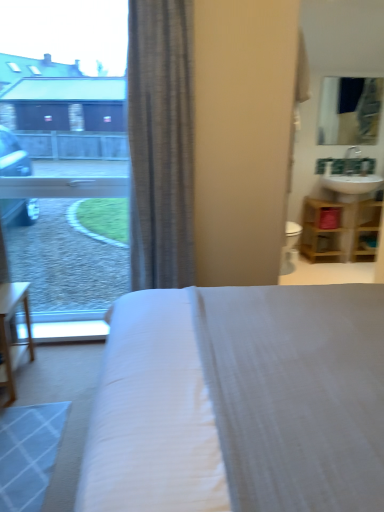
Question: Considering the relative positions of white fabric bed at center and gray textured curtain at center in the image provided, is white fabric bed at center behind gray textured curtain at center?

Choices:
 (A) no
 (B) yes

Answer: (A)

Question: Does white fabric bed at center have a larger size compared to gray textured curtain at center?

Choices:
 (A) yes
 (B) no

Answer: (A)

Question: Would you say white fabric bed at center contains gray textured curtain at center?

Choices:
 (A) yes
 (B) no

Answer: (B)

Question: Is white fabric bed at center positioned with its back to gray textured curtain at center?

Choices:
 (A) yes
 (B) no

Answer: (B)

Question: Can you confirm if white fabric bed at center is thinner than gray textured curtain at center?

Choices:
 (A) no
 (B) yes

Answer: (A)

Question: From their relative heights in the image, would you say gray textured curtain at center is taller or shorter than wooden shelf at right?

Choices:
 (A) short
 (B) tall

Answer: (B)

Question: From a real-world perspective, is gray textured curtain at center positioned above or below wooden shelf at right?

Choices:
 (A) below
 (B) above

Answer: (B)

Question: Does point (137, 37) appear closer or farther from the camera than point (332, 218)?

Choices:
 (A) closer
 (B) farther

Answer: (A)

Question: Considering the relative positions of gray textured curtain at center and wooden shelf at right in the image provided, is gray textured curtain at center to the left or to the right of wooden shelf at right?

Choices:
 (A) right
 (B) left

Answer: (B)

Question: Is matte glass mirror at upper right taller or shorter than transparent glass window at upper left?

Choices:
 (A) tall
 (B) short

Answer: (B)

Question: Based on their sizes in the image, would you say matte glass mirror at upper right is bigger or smaller than transparent glass window at upper left?

Choices:
 (A) big
 (B) small

Answer: (B)

Question: From the image's perspective, relative to transparent glass window at upper left, is matte glass mirror at upper right above or below?

Choices:
 (A) above
 (B) below

Answer: (A)

Question: Is matte glass mirror at upper right inside or outside of transparent glass window at upper left?

Choices:
 (A) inside
 (B) outside

Answer: (B)

Question: Considering the positions of white fabric bed at center and transparent glass window at upper left in the image, is white fabric bed at center bigger or smaller than transparent glass window at upper left?

Choices:
 (A) small
 (B) big

Answer: (B)

Question: From the image's perspective, is white fabric bed at center positioned above or below transparent glass window at upper left?

Choices:
 (A) below
 (B) above

Answer: (A)